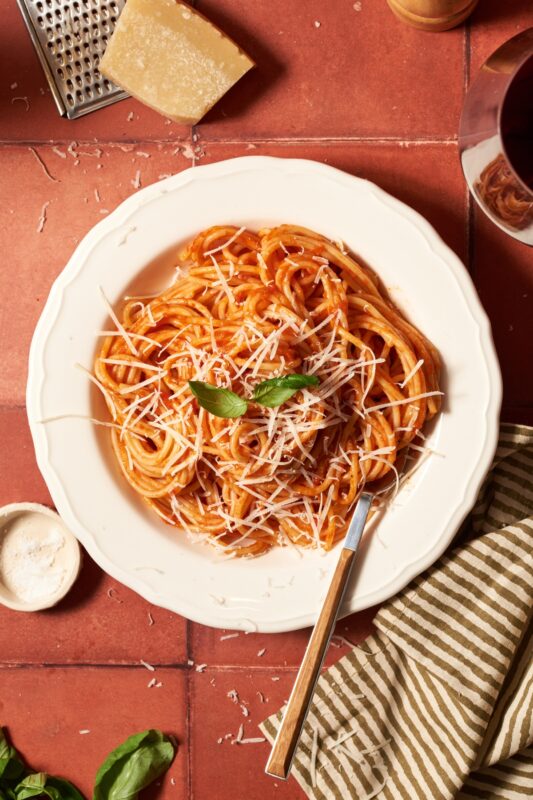
The height and width of the screenshot is (800, 533). I want to click on brown and white striped napkin, so click(426, 677).